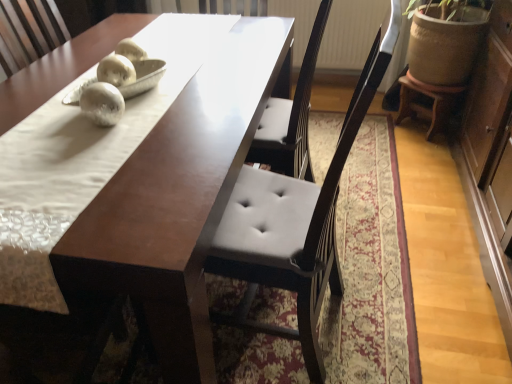
Question: Considering their positions, is matte brown table at center located in front of or behind white fabric mat at center?

Choices:
 (A) front
 (B) behind

Answer: (B)

Question: From a real-world perspective, is matte brown table at center positioned above or below white fabric mat at center?

Choices:
 (A) below
 (B) above

Answer: (A)

Question: Which object is positioned closest to the wooden stool at right?

Choices:
 (A) white fabric mat at center
 (B) matte brown table at center

Answer: (A)

Question: Estimate the real-world distances between objects in this image. Which object is closer to the wooden stool at right?

Choices:
 (A) matte brown table at center
 (B) white fabric mat at center

Answer: (B)